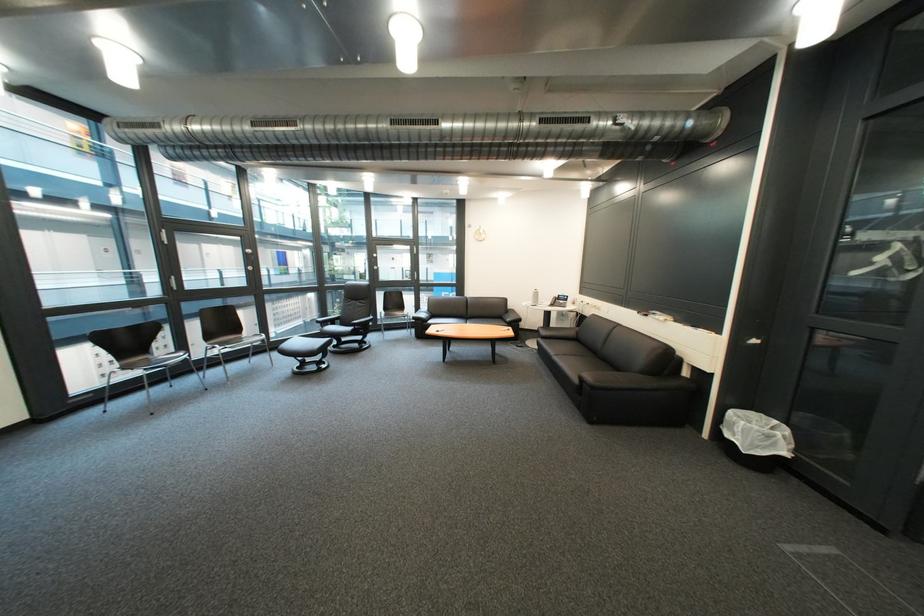
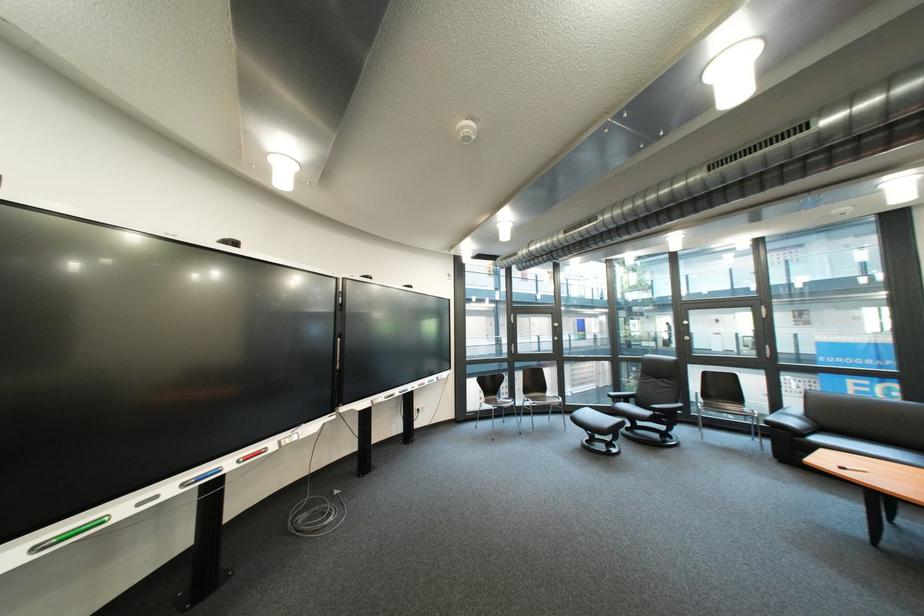
Find the pixel in the second image that matches pixel 436 315 in the first image.

(806, 423)